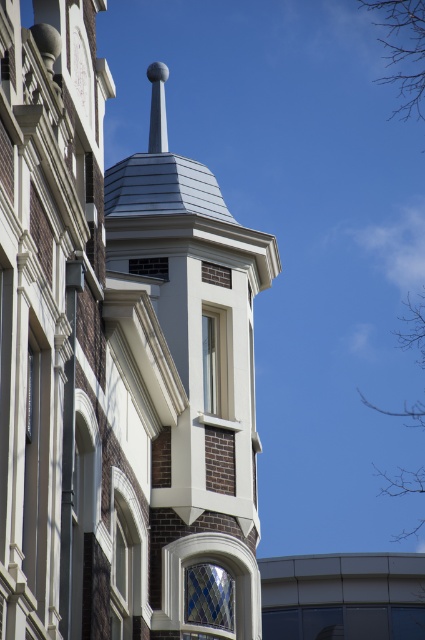
How far apart are white smooth tower at center and blue diamond-patterned glass at center?

white smooth tower at center is 15.23 feet away from blue diamond-patterned glass at center.

Can you confirm if white smooth tower at center is positioned to the right of blue diamond-patterned glass at center?

Incorrect, white smooth tower at center is not on the right side of blue diamond-patterned glass at center.

Does point (172, 216) come farther from viewer compared to point (231, 593)?

Yes, it is.

Where is `white smooth tower at center`? This screenshot has height=640, width=425. white smooth tower at center is located at coordinates (190, 372).

Identify the location of white smooth tower at center. The width and height of the screenshot is (425, 640). (190, 372).

Is white smooth tower at center above matte gray window at upper center?

No, white smooth tower at center is not above matte gray window at upper center.

Which is in front, point (252, 236) or point (155, 269)?

Point (155, 269) is more forward.

Where is `white smooth tower at center`? white smooth tower at center is located at coordinates (190, 372).

Does blue diamond-patterned glass at center appear under matte gray window at upper center?

Yes.

Locate an element on the screen. The image size is (425, 640). blue diamond-patterned glass at center is located at coordinates (209, 596).